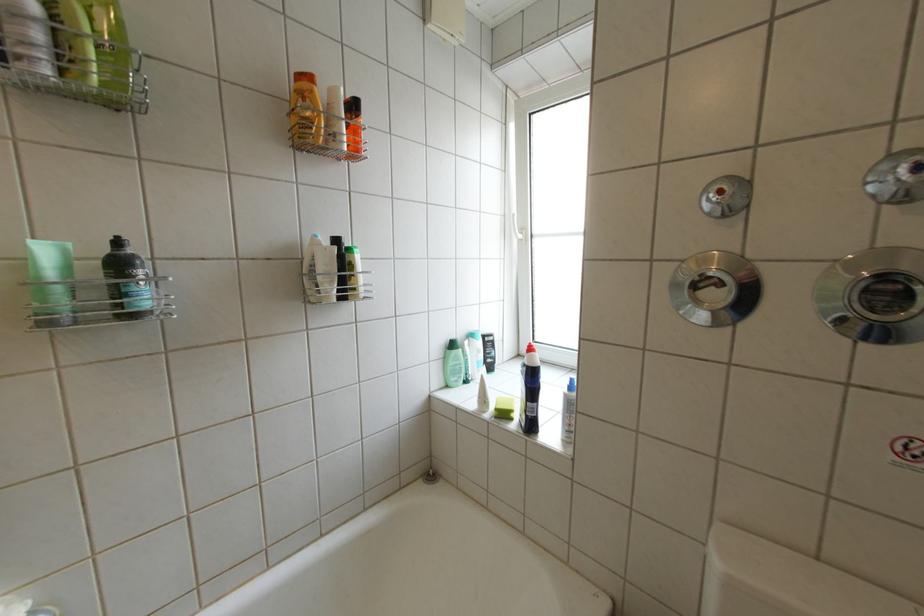
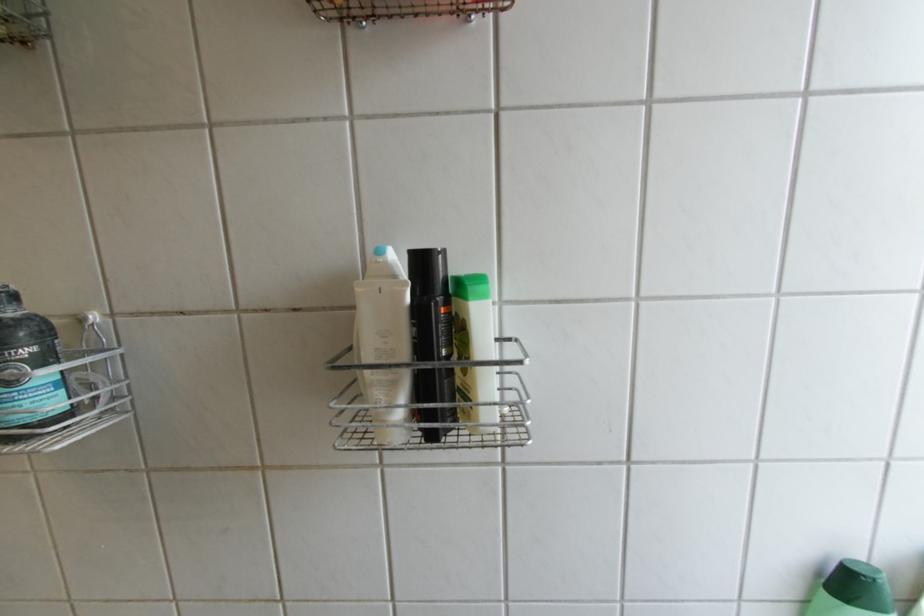
In the second image, find the point that corresponds to (x=345, y=283) in the first image.

(407, 387)